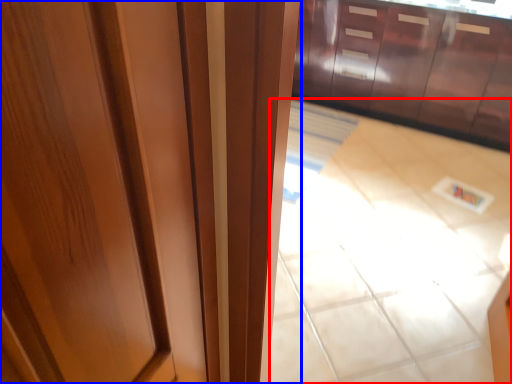
Question: Which object is closer to the camera taking this photo, tile (highlighted by a red box) or door (highlighted by a blue box)?

Choices:
 (A) tile
 (B) door

Answer: (B)